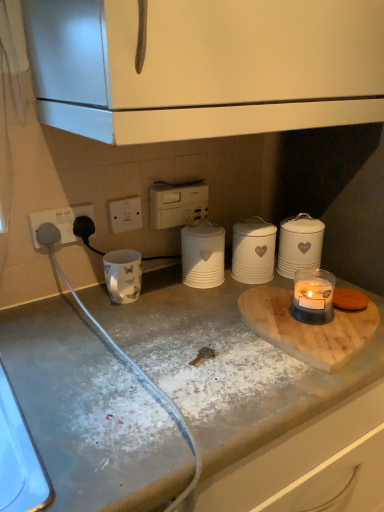
Question: From their relative heights in the image, would you say white plastic electric outlet at center is taller or shorter than wooden cutting board at center?

Choices:
 (A) short
 (B) tall

Answer: (B)

Question: Considering the positions of white plastic electric outlet at center and wooden cutting board at center in the image, is white plastic electric outlet at center wider or thinner than wooden cutting board at center?

Choices:
 (A) thin
 (B) wide

Answer: (A)

Question: Based on their relative distances, which object is nearer to the translucent glass candle at lower right?

Choices:
 (A) white plastic electric outlet at center
 (B) white plastic electrical outlet at center, marked as the second appliance in a bottom-to-top arrangement
 (C) wooden cutting board at center
 (D) white ceramic canister at center, the 1th appliance from the bottom
 (E) white ceramic canister at center-right, which ranks as the 1th kitchen appliance in right-to-left order

Answer: (C)

Question: Considering the real-world distances, which object is farthest from the white matte canister at center, placed as the 2th kitchen appliance when sorted from right to left?

Choices:
 (A) white ceramic canister at center, which ranks as the 2th appliance in top-to-bottom order
 (B) white ceramic canister at center-right, positioned as the second kitchen appliance in left-to-right order
 (C) black rubber power plugs at left
 (D) white plastic electric outlet at center
 (E) translucent glass candle at lower right

Answer: (C)